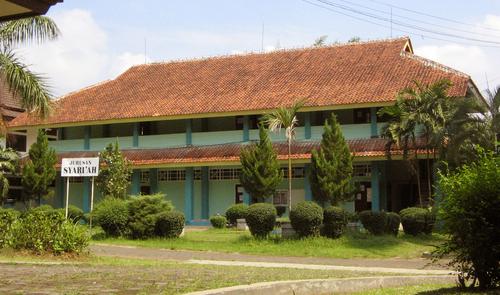
The image size is (500, 295). I want to click on door, so click(x=242, y=192), click(x=361, y=195).